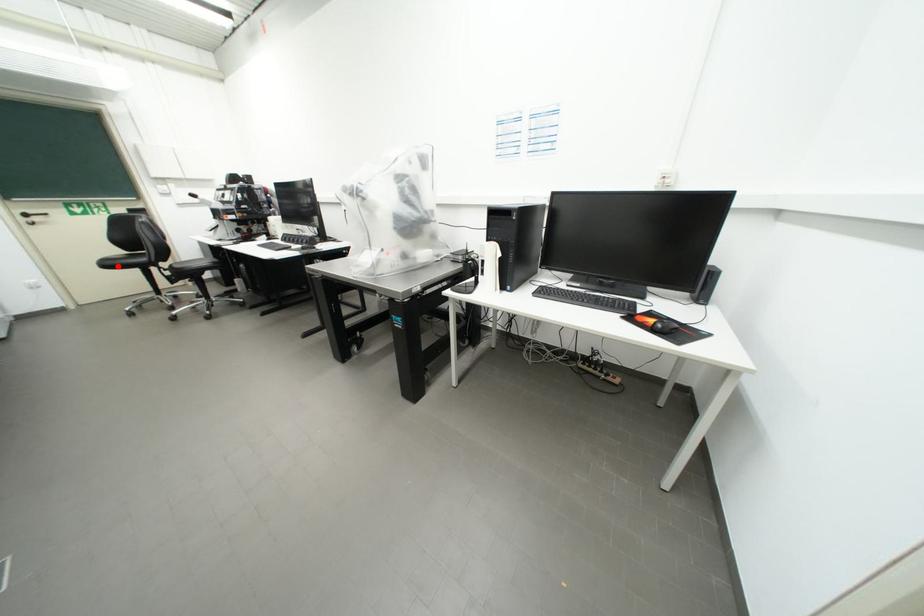
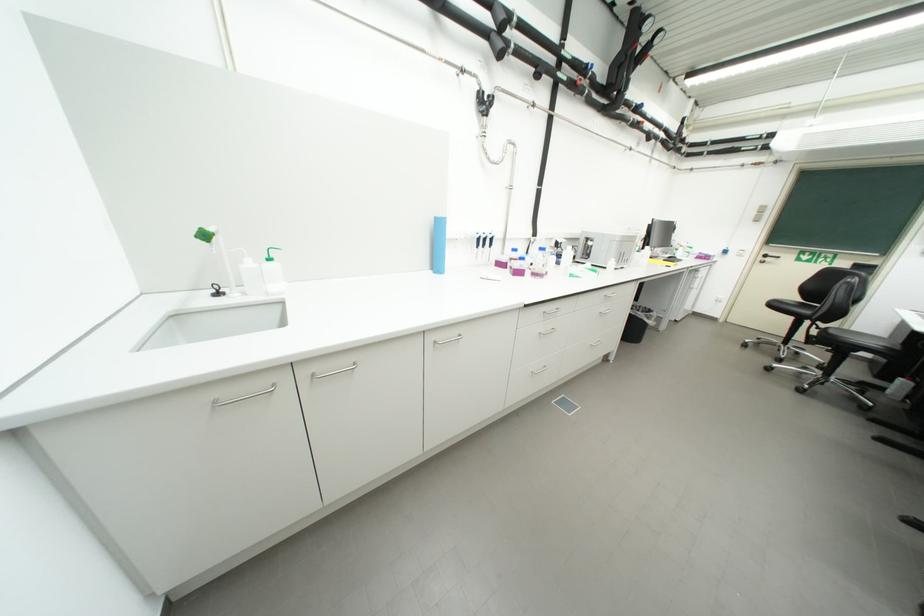
Where in the second image is the point corresponding to the highlighted location from the first image?

(783, 307)